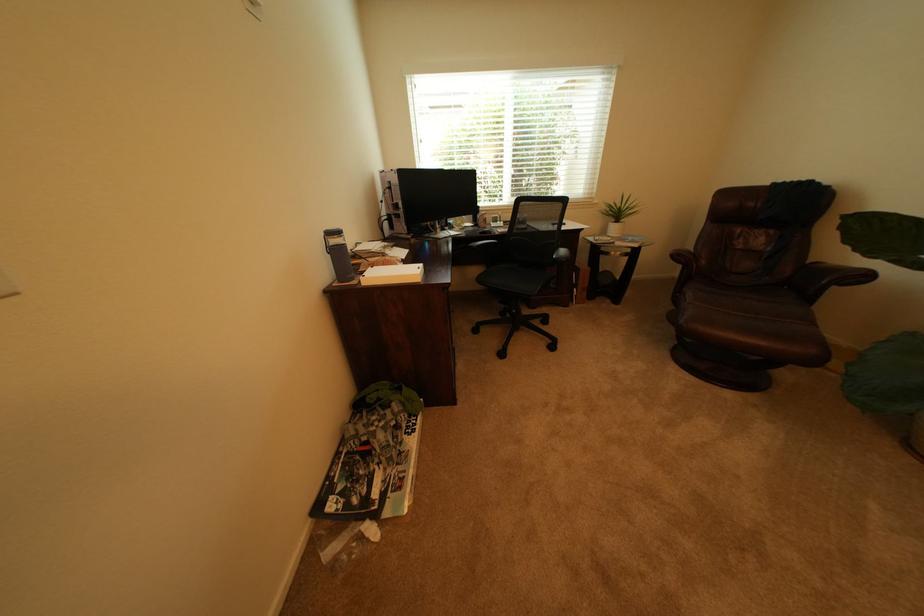
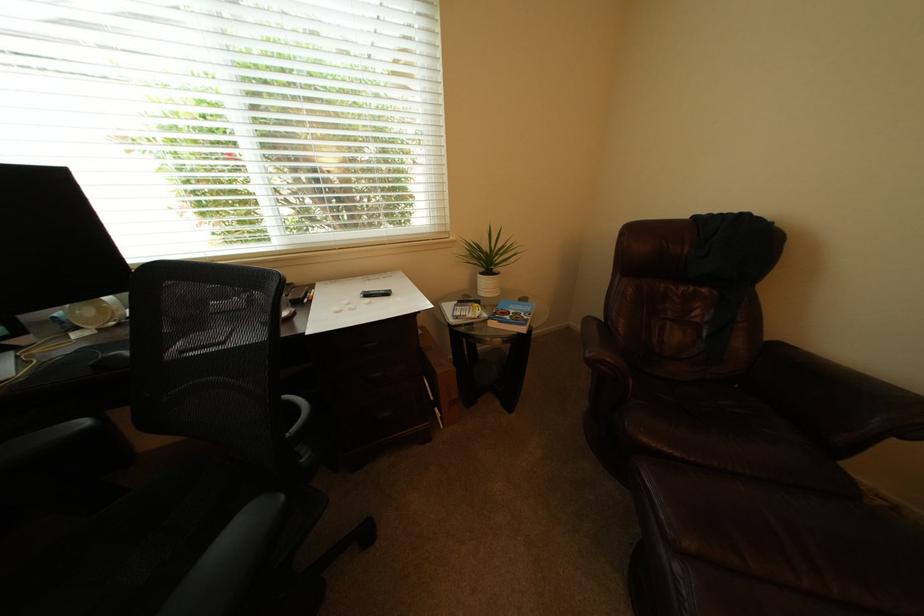
In the second image, find the point that corresponds to point (684, 281) in the first image.

(579, 331)